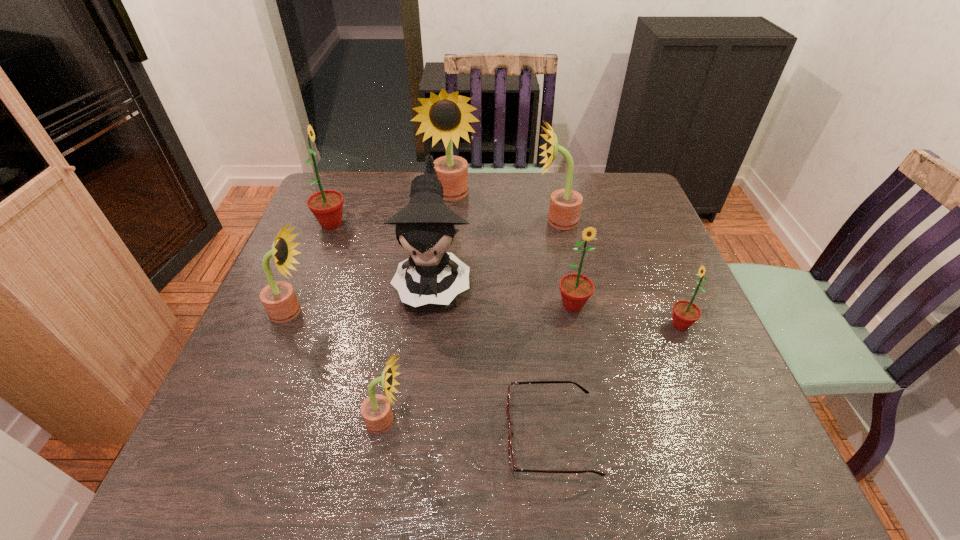
You are a GUI agent. You are given a task and a screenshot of the screen. Output one action in this format:
    pyautogui.click(x=<x>, y=<y>)
    Task: Click on the free spot that satisfies the following two spatial constraints: 1. on the face of the third smallest yellow sunflower; 2. on the face of the second green sunflower from right to left
    Image resolution: width=960 pixels, height=540 pixels.
    Given the screenshot: What is the action you would take?
    pyautogui.click(x=574, y=306)